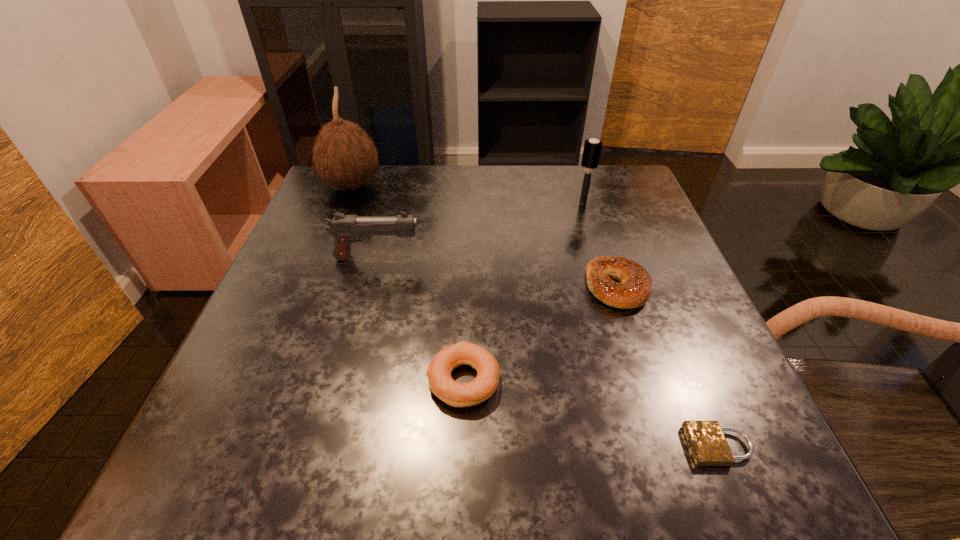
Locate an element on the screen. free space that is in between the fifth shortest object and the tallest object is located at coordinates (468, 194).

This screenshot has height=540, width=960. I want to click on blank region between the third object from left to right and the fifth shortest object, so click(x=523, y=292).

Locate which object is the closest to the third object from left to right. Please provide its 2D coordinates. Your answer should be formatted as a tuple, i.e. [(x, y)], where the tuple contains the x and y coordinates of a point satisfying the conditions above.

[(634, 290)]

Locate an element on the screen. The image size is (960, 540). object that is the fourth closest to the nearest object is located at coordinates (592, 148).

Where is `vacant area that satisfies the following two spatial constraints: 1. on the surface of the second tallest object; 2. on the left side of the coconut`? vacant area that satisfies the following two spatial constraints: 1. on the surface of the second tallest object; 2. on the left side of the coconut is located at coordinates (345, 203).

This screenshot has height=540, width=960. Find the location of `vacant space that satisfies the following two spatial constraints: 1. on the surface of the tallest object; 2. on the left side of the fifth shortest object`. vacant space that satisfies the following two spatial constraints: 1. on the surface of the tallest object; 2. on the left side of the fifth shortest object is located at coordinates (345, 203).

Identify the location of free space that satisfies the following two spatial constraints: 1. on the back side of the hairbrush; 2. on the left side of the fourth object from right to left. The height and width of the screenshot is (540, 960). (469, 203).